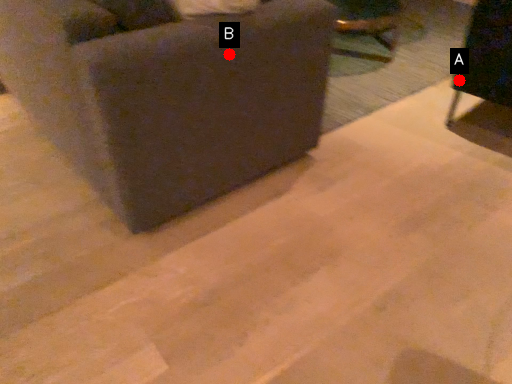
Question: Two points are circled on the image, labeled by A and B beside each circle. Among these points, which one is farthest from the camera?

Choices:
 (A) A is further
 (B) B is further

Answer: (A)